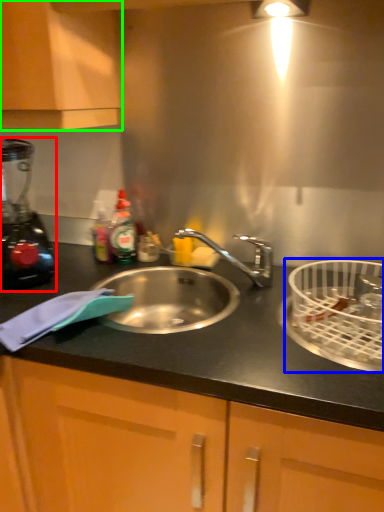
Question: Based on their relative distances, which object is farther from blender (highlighted by a red box)? Choose from basket (highlighted by a blue box) and cabinetry (highlighted by a green box).

Choices:
 (A) basket
 (B) cabinetry

Answer: (A)